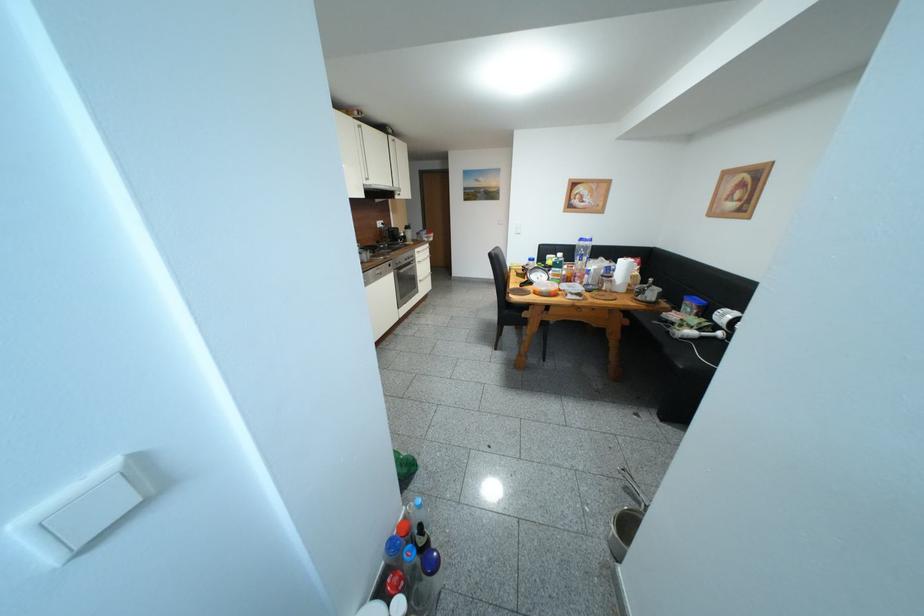
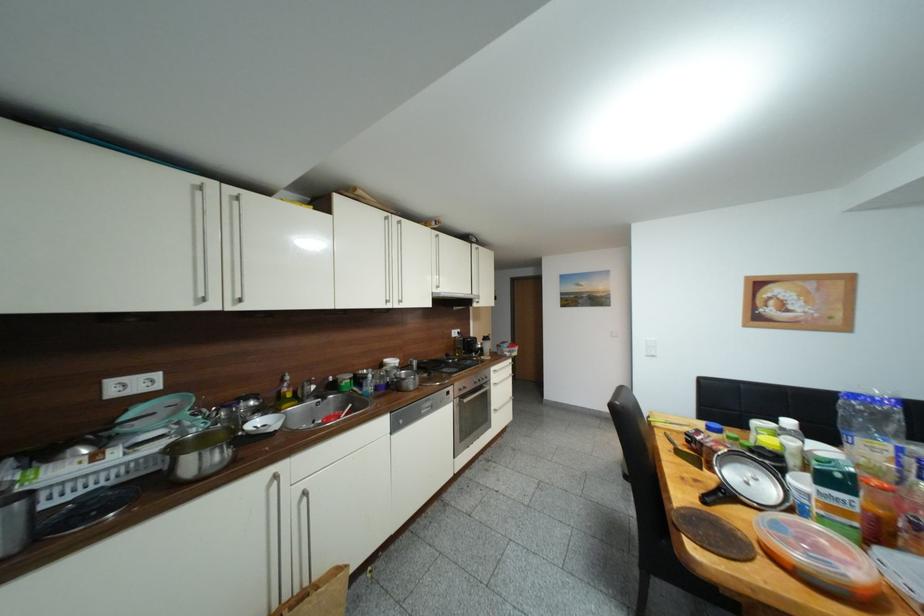
The first image is from the beginning of the video and the second image is from the end. How did the camera likely rotate when shooting the video?

The camera's rotation is toward left-up.